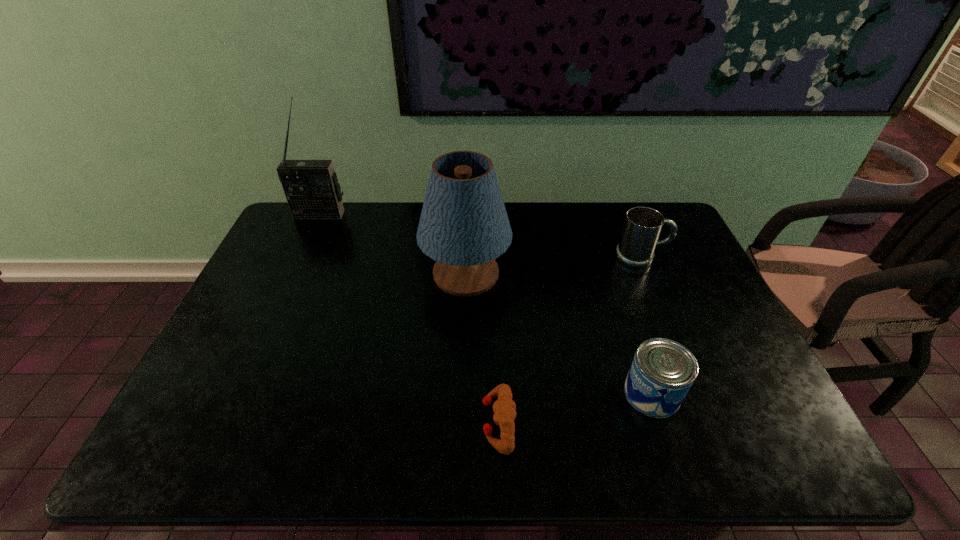
I want to click on vacant region between the puncher and the second shortest object, so click(575, 408).

This screenshot has width=960, height=540. Identify the location of empty space that is in between the can and the shortest object. (575, 408).

The width and height of the screenshot is (960, 540). What are the coordinates of `vacant area between the lampshade and the mug` in the screenshot? It's located at (553, 266).

I want to click on free spot between the third tallest object and the lampshade, so click(553, 266).

Locate an element on the screen. The image size is (960, 540). free point between the radio receiver and the can is located at coordinates (486, 304).

Identify the location of free area in between the puncher and the lampshade. This screenshot has height=540, width=960. (482, 348).

Where is `object that is the closest to the farthest object`? The image size is (960, 540). object that is the closest to the farthest object is located at coordinates (464, 226).

The image size is (960, 540). I want to click on object that is the third closest one to the fourth tallest object, so click(x=643, y=225).

What are the coordinates of `free region that satisfies the following two spatial constraints: 1. on the display of the farthest object; 2. on the right side of the lampshade` in the screenshot? It's located at (293, 274).

I want to click on vacant space that satisfies the following two spatial constraints: 1. on the side of the mug with the handle; 2. on the front side of the lampshade, so click(x=648, y=274).